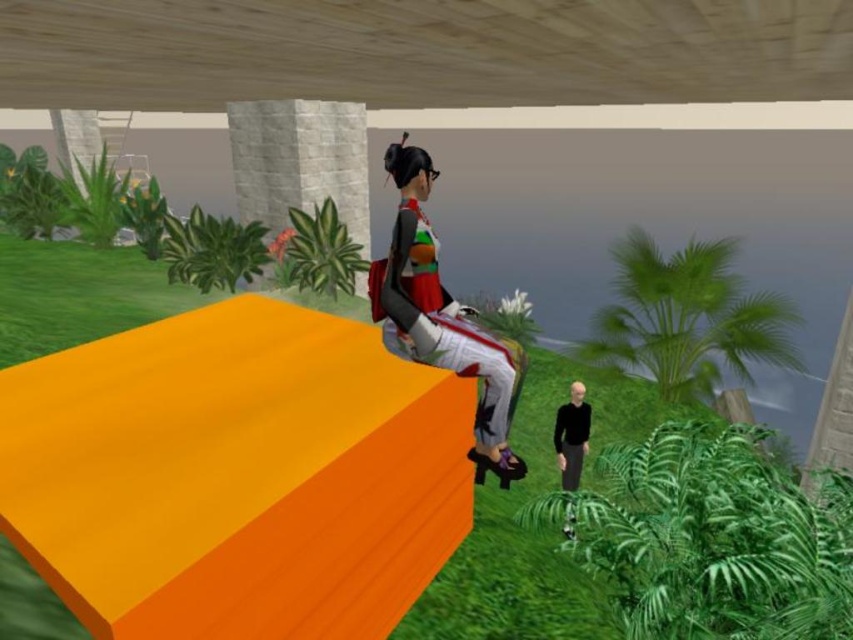
Between gray stone pillar at upper center and black matte shirt at lower right, which one is positioned lower?

Positioned lower is black matte shirt at lower right.

Between gray stone pillar at upper center and black matte shirt at lower right, which one has more height?

gray stone pillar at upper center

Who is more forward, (309, 173) or (566, 444)?

Point (566, 444) is more forward.

Locate an element on the screen. This screenshot has height=640, width=853. gray stone pillar at upper center is located at coordinates (300, 161).

In the scene shown: Which of these two, matte fabric outfit at center or black matte shirt at lower right, stands taller?

matte fabric outfit at center

Which is behind, point (415, 243) or point (567, 449)?

The point (567, 449) is more distant.

Which is behind, point (399, 164) or point (561, 460)?

Point (561, 460)

Image resolution: width=853 pixels, height=640 pixels. In order to click on matte fabric outfit at center in this screenshot , I will do `click(438, 310)`.

Is matte fabric outfit at center taller than gray stone pillar at upper center?

Yes, matte fabric outfit at center is taller than gray stone pillar at upper center.

This screenshot has width=853, height=640. What do you see at coordinates (438, 310) in the screenshot?
I see `matte fabric outfit at center` at bounding box center [438, 310].

The width and height of the screenshot is (853, 640). What do you see at coordinates (438, 310) in the screenshot?
I see `matte fabric outfit at center` at bounding box center [438, 310].

Find the location of a particular element. Image resolution: width=853 pixels, height=640 pixels. matte fabric outfit at center is located at coordinates (438, 310).